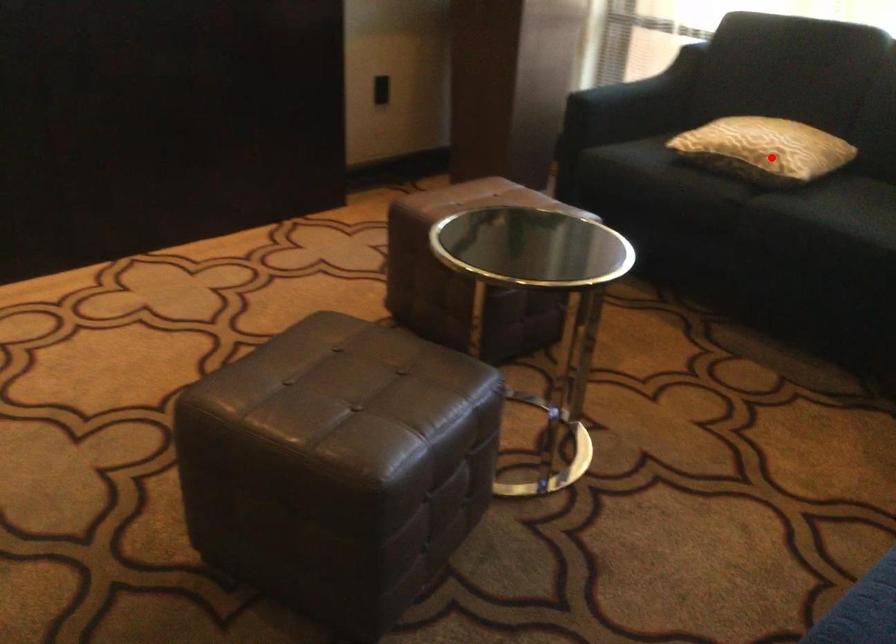
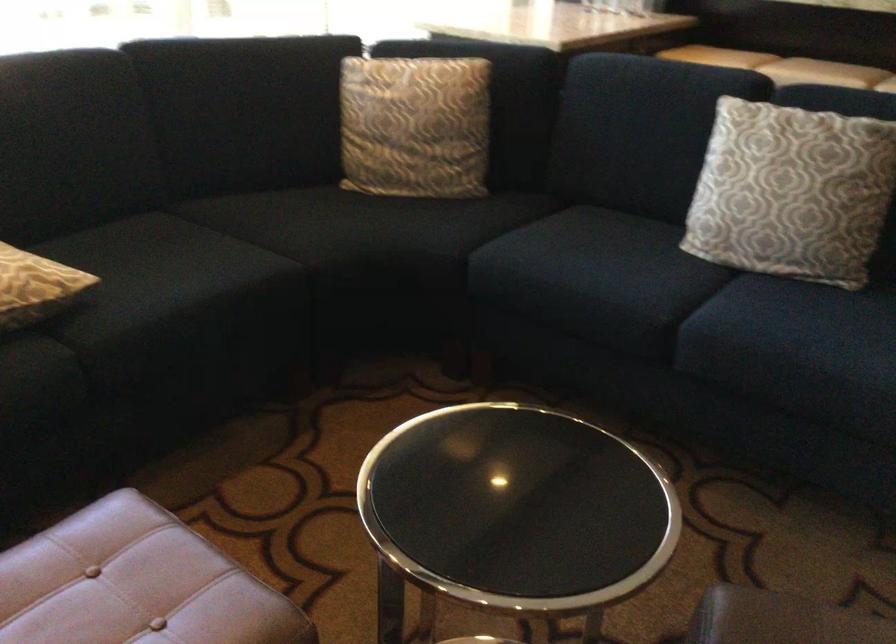
Locate, in the second image, the point that corresponds to the highlighted location in the first image.

(35, 287)